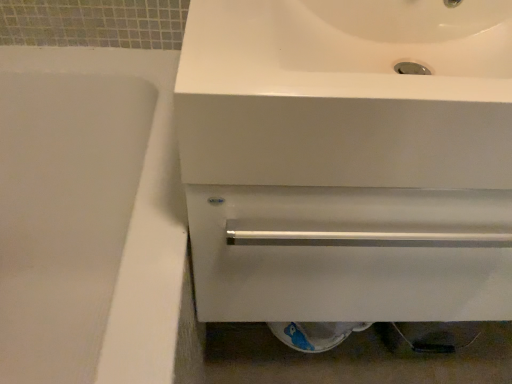
This screenshot has width=512, height=384. What do you see at coordinates (347, 159) in the screenshot?
I see `white glossy sink at upper center` at bounding box center [347, 159].

This screenshot has height=384, width=512. I want to click on white glossy sink at upper center, so click(347, 159).

Find the location of `white glossy bathtub at left`. white glossy bathtub at left is located at coordinates (94, 204).

What do you see at coordinates (94, 204) in the screenshot? I see `white glossy bathtub at left` at bounding box center [94, 204].

Identify the location of white glossy sink at upper center. (347, 159).

Which is more to the right, white glossy sink at upper center or white glossy bathtub at left?

white glossy sink at upper center.

Who is more distant, white glossy sink at upper center or white glossy bathtub at left?

white glossy sink at upper center is further away from the camera.

Which is in front, point (356, 66) or point (111, 364)?

Positioned in front is point (111, 364).

From the image's perspective, between white glossy sink at upper center and white glossy bathtub at left, which one is located above?

white glossy sink at upper center, from the image's perspective.

From the picture: From a real-world perspective, who is located higher, white glossy sink at upper center or white glossy bathtub at left?

In real-world perspective, white glossy sink at upper center is above.

Consider the image. Is white glossy sink at upper center wider than white glossy bathtub at left?

Correct, the width of white glossy sink at upper center exceeds that of white glossy bathtub at left.

Does white glossy sink at upper center have a greater height compared to white glossy bathtub at left?

Incorrect, the height of white glossy sink at upper center is not larger of that of white glossy bathtub at left.

Between white glossy sink at upper center and white glossy bathtub at left, which one has smaller size?

white glossy sink at upper center.

Consider the image. Is white glossy sink at upper center outside of white glossy bathtub at left?

Yes, white glossy sink at upper center is not within white glossy bathtub at left.

Is white glossy sink at upper center not near white glossy bathtub at left?

white glossy sink at upper center is actually quite close to white glossy bathtub at left.

Is white glossy sink at upper center oriented away from white glossy bathtub at left?

No, white glossy sink at upper center is not facing the opposite direction of white glossy bathtub at left.

How many degrees apart are the facing directions of white glossy sink at upper center and white glossy bathtub at left?

The facing directions of white glossy sink at upper center and white glossy bathtub at left are 89.8 degrees apart.

Where is `bath below the white glossy sink at upper center (from the image's perspective)`? The width and height of the screenshot is (512, 384). bath below the white glossy sink at upper center (from the image's perspective) is located at coordinates (94, 204).

Considering the relative positions of white glossy bathtub at left and white glossy sink at upper center in the image provided, is white glossy bathtub at left to the left of white glossy sink at upper center from the viewer's perspective?

Yes.

Considering their positions, is white glossy bathtub at left located in front of or behind white glossy sink at upper center?

white glossy bathtub at left is in front of white glossy sink at upper center.

Does point (123, 355) appear closer or farther from the camera than point (464, 189)?

Point (123, 355) is closer to the camera than point (464, 189).

From the image's perspective, which is above, white glossy bathtub at left or white glossy sink at upper center?

From the image's view, white glossy sink at upper center is above.

From a real-world perspective, is white glossy bathtub at left positioned above or below white glossy sink at upper center?

Result: In terms of real-world spatial position, white glossy bathtub at left is below white glossy sink at upper center.

Considering the sizes of white glossy bathtub at left and white glossy sink at upper center in the image, is white glossy bathtub at left wider or thinner than white glossy sink at upper center?

white glossy bathtub at left is thinner than white glossy sink at upper center.

Is white glossy bathtub at left taller than white glossy sink at upper center?

Correct, white glossy bathtub at left is much taller as white glossy sink at upper center.

Looking at the image, does white glossy bathtub at left seem bigger or smaller compared to white glossy sink at upper center?

Considering their sizes, white glossy bathtub at left takes up more space than white glossy sink at upper center.

Is white glossy bathtub at left not within white glossy sink at upper center?

Yes, white glossy bathtub at left is outside of white glossy sink at upper center.

Would you consider white glossy bathtub at left to be distant from white glossy sink at upper center?

white glossy bathtub at left is actually quite close to white glossy sink at upper center.

Could you tell me if white glossy bathtub at left is facing white glossy sink at upper center?

Yes, white glossy bathtub at left is aimed at white glossy sink at upper center.

How many degrees apart are the facing directions of white glossy bathtub at left and white glossy sink at upper center?

The facing directions of white glossy bathtub at left and white glossy sink at upper center are 89.8 degrees apart.

This screenshot has height=384, width=512. In order to click on sink that is behind the white glossy bathtub at left in this screenshot , I will do `click(347, 159)`.

At what (x,y) coordinates should I click in order to perform the action: click on bath that is on the left side of white glossy sink at upper center. Please return your answer as a coordinate pair (x, y). The image size is (512, 384). Looking at the image, I should click on (94, 204).

Find the location of a particular element. Image resolution: width=512 pixels, height=384 pixels. bath below the white glossy sink at upper center (from a real-world perspective) is located at coordinates (94, 204).